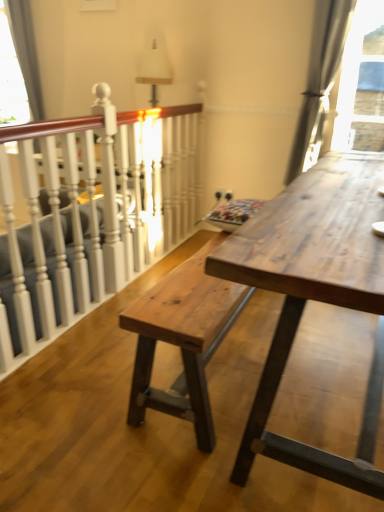
Question: From a real-world perspective, is natural wood table at center physically below white painted wood at left?

Choices:
 (A) yes
 (B) no

Answer: (A)

Question: Does natural wood table at center turn towards white painted wood at left?

Choices:
 (A) no
 (B) yes

Answer: (B)

Question: Can you confirm if natural wood table at center is positioned to the left of white painted wood at left?

Choices:
 (A) no
 (B) yes

Answer: (A)

Question: Is natural wood table at center positioned in front of white painted wood at left?

Choices:
 (A) yes
 (B) no

Answer: (A)

Question: Considering the relative sizes of natural wood table at center and white painted wood at left in the image provided, is natural wood table at center bigger than white painted wood at left?

Choices:
 (A) yes
 (B) no

Answer: (A)

Question: Based on their sizes in the image, would you say natural wood bench at center is bigger or smaller than transparent glass window at upper left?

Choices:
 (A) big
 (B) small

Answer: (A)

Question: Is natural wood bench at center wider or thinner than transparent glass window at upper left?

Choices:
 (A) wide
 (B) thin

Answer: (A)

Question: Considering their positions, is natural wood bench at center located in front of or behind transparent glass window at upper left?

Choices:
 (A) front
 (B) behind

Answer: (A)

Question: From a real-world perspective, is natural wood bench at center above or below transparent glass window at upper left?

Choices:
 (A) below
 (B) above

Answer: (A)

Question: Based on their sizes in the image, would you say satin gray curtain at upper right is bigger or smaller than natural wood table at center?

Choices:
 (A) big
 (B) small

Answer: (B)

Question: Considering the positions of satin gray curtain at upper right and natural wood table at center in the image, is satin gray curtain at upper right wider or thinner than natural wood table at center?

Choices:
 (A) thin
 (B) wide

Answer: (A)

Question: Is satin gray curtain at upper right inside or outside of natural wood table at center?

Choices:
 (A) inside
 (B) outside

Answer: (B)

Question: Considering their positions, is satin gray curtain at upper right located in front of or behind natural wood table at center?

Choices:
 (A) behind
 (B) front

Answer: (A)

Question: Considering the positions of transparent glass window at upper left and satin gray curtain at upper right in the image, is transparent glass window at upper left taller or shorter than satin gray curtain at upper right?

Choices:
 (A) short
 (B) tall

Answer: (A)

Question: Looking at the image, does transparent glass window at upper left seem bigger or smaller compared to satin gray curtain at upper right?

Choices:
 (A) small
 (B) big

Answer: (A)